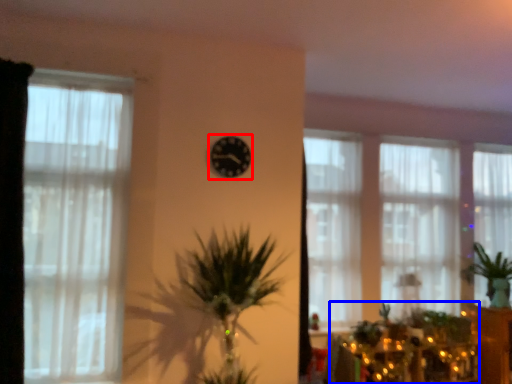
Question: Which object appears farthest to the camera in this image, clock (highlighted by a red box) or christmas decoration (highlighted by a blue box)?

Choices:
 (A) clock
 (B) christmas decoration

Answer: (B)